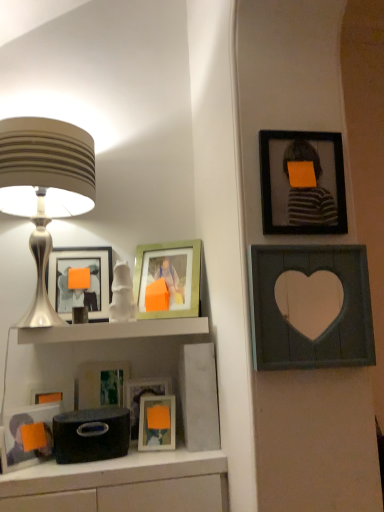
Question: From a real-world perspective, is white glossy shelf at center positioned above or below wooden heart-shaped frame at upper right, marked as the 7th picture frame in a left-to-right arrangement?

Choices:
 (A) below
 (B) above

Answer: (A)

Question: From the image's perspective, relative to wooden heart-shaped frame at upper right, arranged as the 1th picture frame when viewed from the right, is white glossy shelf at center above or below?

Choices:
 (A) above
 (B) below

Answer: (B)

Question: Considering the real-world distances, which object is farthest from the silver metallic lampshade at left?

Choices:
 (A) white glossy shelf at center
 (B) white glossy statue at center
 (C) wooden heart-shaped frame at upper right, arranged as the 1th picture frame when viewed from the right
 (D) matte orange picture frame at center, which is the fifth picture frame in left-to-right order
 (E) matte black picture frame at lower left, marked as the sixth picture frame in a right-to-left arrangement

Answer: (C)

Question: Based on their relative distances, which object is nearer to the silver metallic lampshade at left?

Choices:
 (A) black matte picture frame at upper right, marked as the 6th picture frame in a left-to-right arrangement
 (B) wooden heart-shaped frame at upper right, arranged as the 1th picture frame when viewed from the right
 (C) matte black picture frame at left, positioned as the fifth picture frame in right-to-left order
 (D) white glossy shelf at center
 (E) matte black picture frame at lower left, the second picture frame from the left

Answer: (C)